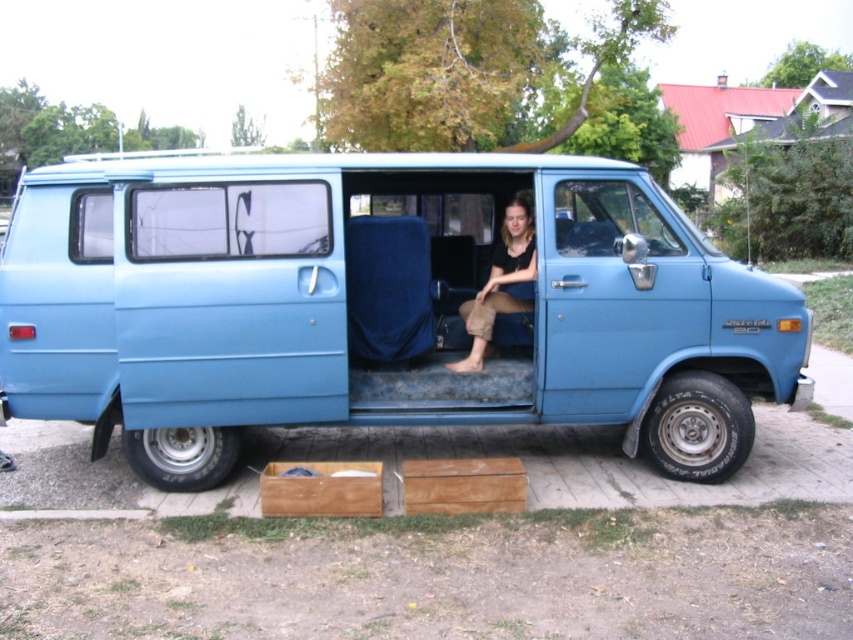
Between blue matte van at center and matte black shirt at center, which one appears on the left side from the viewer's perspective?

blue matte van at center

Which is behind, point (494, 381) or point (520, 268)?

Positioned behind is point (520, 268).

I want to click on blue matte van at center, so click(381, 305).